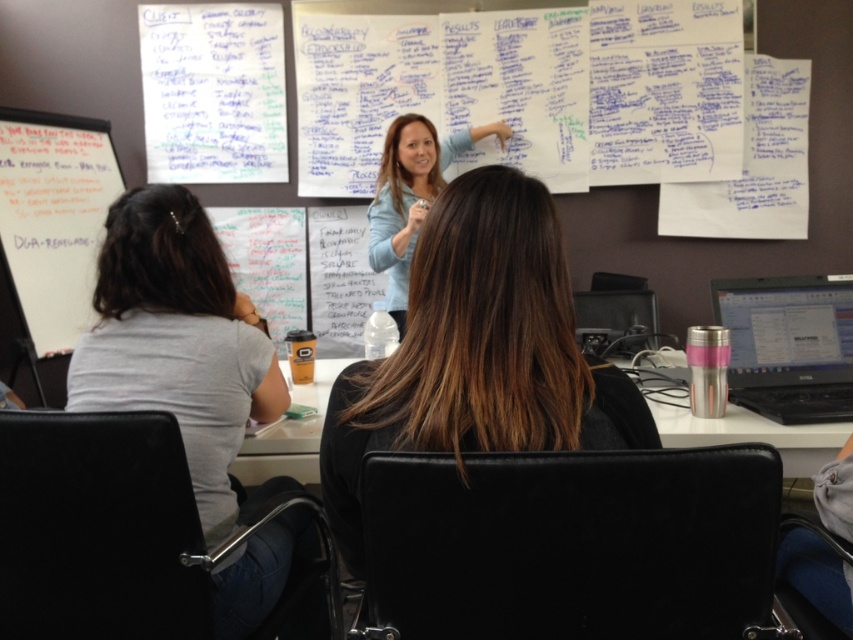
From the picture: Is silver metallic laptop at right bigger than metallic silver cup at center?

Incorrect, silver metallic laptop at right is not larger than metallic silver cup at center.

Does silver metallic laptop at right have a greater height compared to metallic silver cup at center?

Indeed, silver metallic laptop at right has a greater height compared to metallic silver cup at center.

Identify the location of silver metallic laptop at right. (788, 346).

The width and height of the screenshot is (853, 640). I want to click on silver metallic laptop at right, so click(x=788, y=346).

Can you confirm if metallic silver cup at center is smaller than light blue sweater at upper center?

Yes, metallic silver cup at center is smaller than light blue sweater at upper center.

Does metallic silver cup at center appear under light blue sweater at upper center?

Correct, metallic silver cup at center is located below light blue sweater at upper center.

Does point (235, 468) lie in front of point (440, 157)?

Yes, it is in front of point (440, 157).

This screenshot has width=853, height=640. In order to click on metallic silver cup at center in this screenshot , I will do `click(752, 435)`.

Locate an element on the screen. whiteboard at left is located at coordinates coord(53,218).

Between point (56, 236) and point (735, 396), which one is positioned in front?

Positioned in front is point (735, 396).

This screenshot has width=853, height=640. I want to click on whiteboard at left, so click(x=53, y=218).